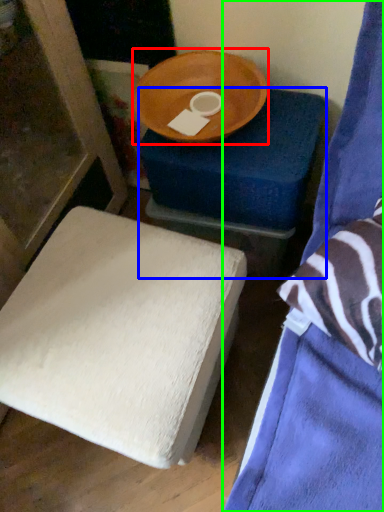
Question: Which object is positioned closest to round table (highlighted by a red box)? Select from furniture (highlighted by a blue box) and furniture (highlighted by a green box).

Choices:
 (A) furniture
 (B) furniture

Answer: (A)